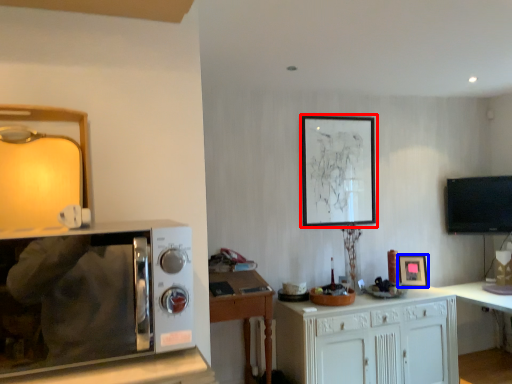
Question: Among these objects, which one is nearest to the camera, picture frame (highlighted by a red box) or picture frame (highlighted by a blue box)?

Choices:
 (A) picture frame
 (B) picture frame

Answer: (B)